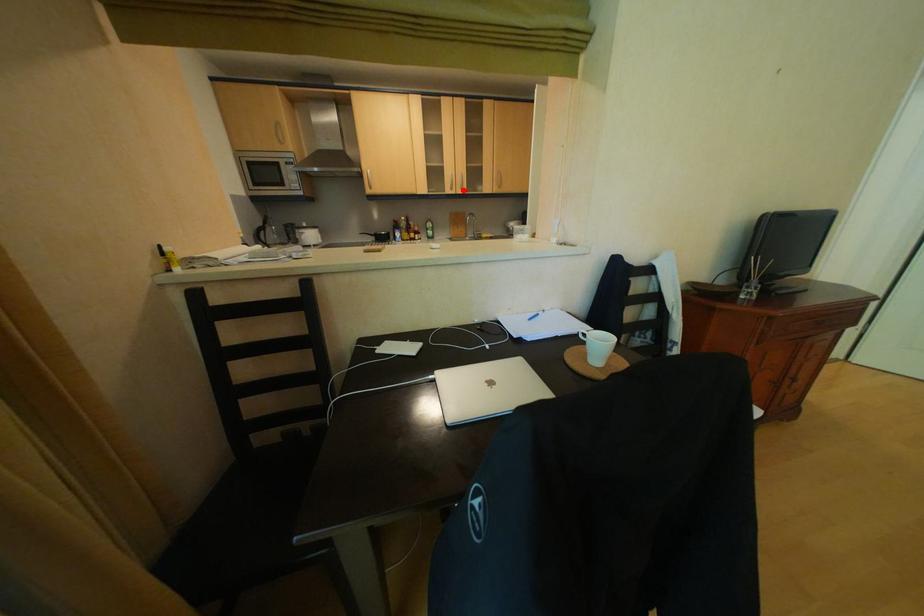
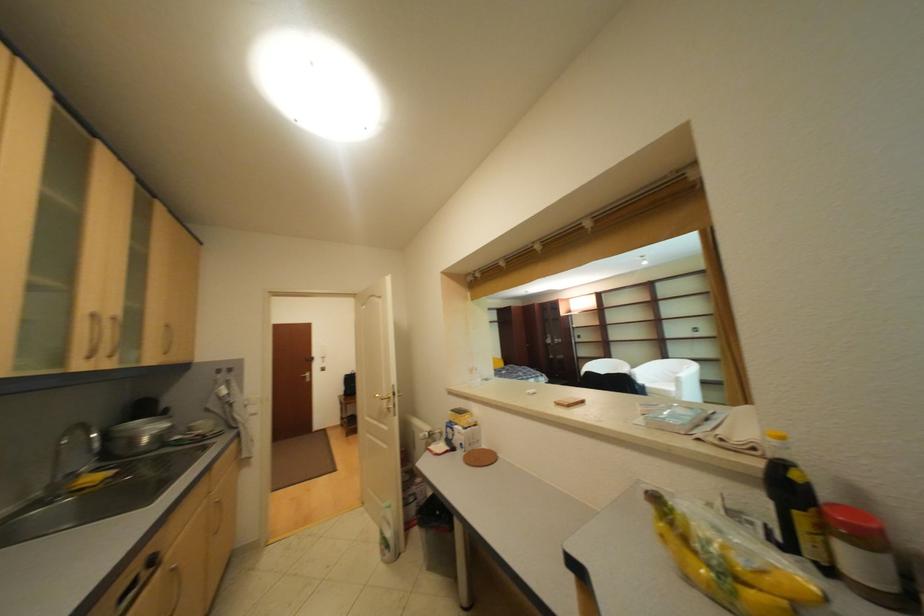
Question: I am providing you with two images of the same scene from different viewpoints. A red point is shown in image1. For the corresponding object point in image2, is it positioned nearer or farther from the camera?

Choices:
 (A) Nearer
 (B) Farther

Answer: (B)